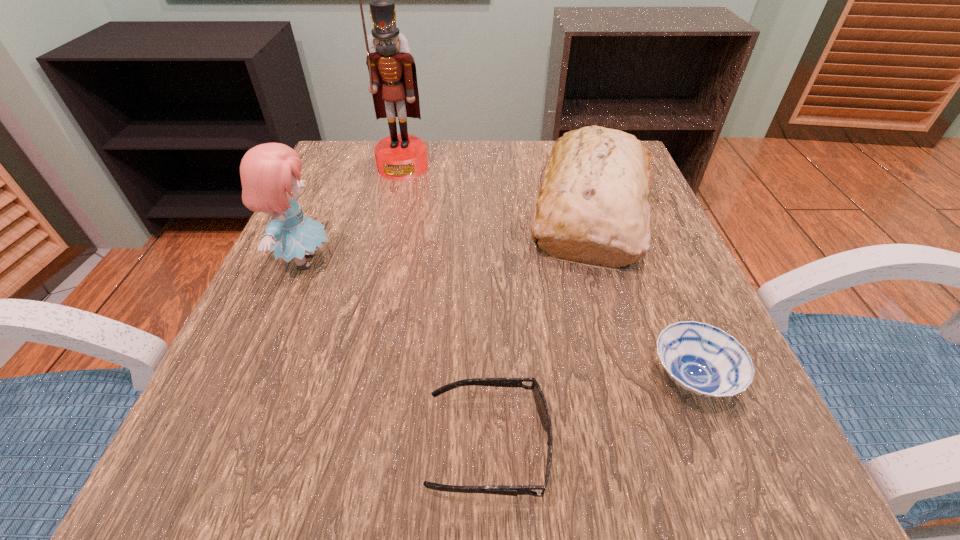
Image resolution: width=960 pixels, height=540 pixels. In order to click on free spot that satisfies the following two spatial constraints: 1. on the front side of the soup bowl; 2. on the front-facing side of the sunglasses in this screenshot , I will do `click(717, 446)`.

Find the location of `vacant space that satisfies the following two spatial constraints: 1. on the front-facing side of the second object from left to right; 2. on the front-facing side of the doll`. vacant space that satisfies the following two spatial constraints: 1. on the front-facing side of the second object from left to right; 2. on the front-facing side of the doll is located at coordinates (380, 261).

The image size is (960, 540). Find the location of `free space that satisfies the following two spatial constraints: 1. on the front-facing side of the fourth object from right to left; 2. on the right side of the third tallest object`. free space that satisfies the following two spatial constraints: 1. on the front-facing side of the fourth object from right to left; 2. on the right side of the third tallest object is located at coordinates (393, 210).

You are a GUI agent. You are given a task and a screenshot of the screen. Output one action in this format:
    pyautogui.click(x=<x>, y=<y>)
    Task: Click on the vacant space that satisfies the following two spatial constraints: 1. on the front-facing side of the doll; 2. on the right side of the soup bowl
    Image resolution: width=960 pixels, height=540 pixels.
    Given the screenshot: What is the action you would take?
    pyautogui.click(x=253, y=379)